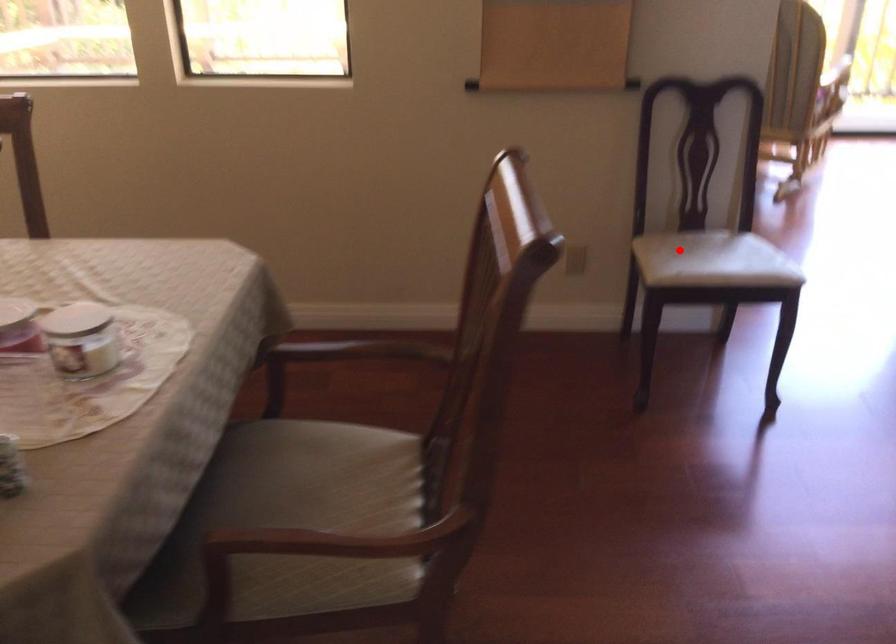
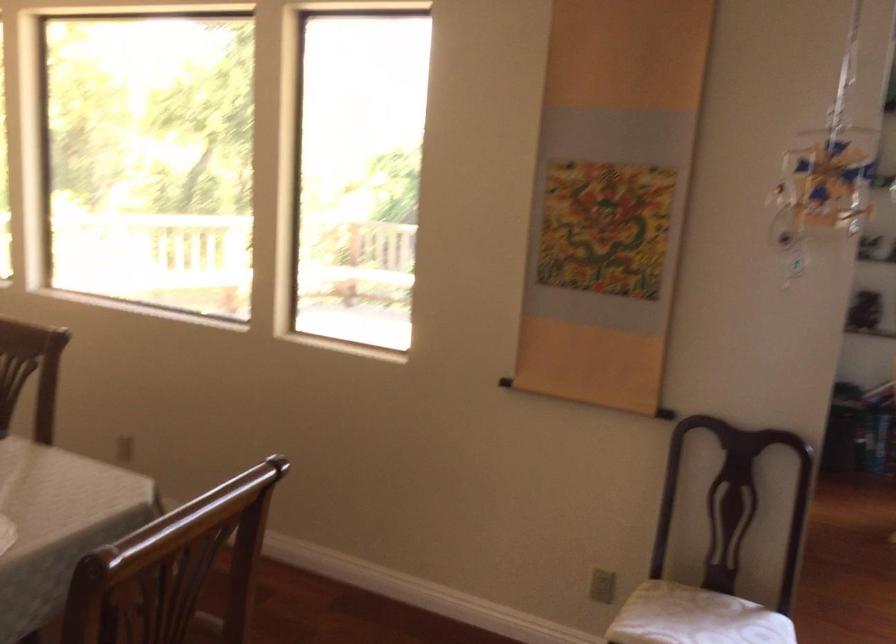
Locate, in the second image, the point that corresponds to the highlighted location in the first image.

(668, 614)